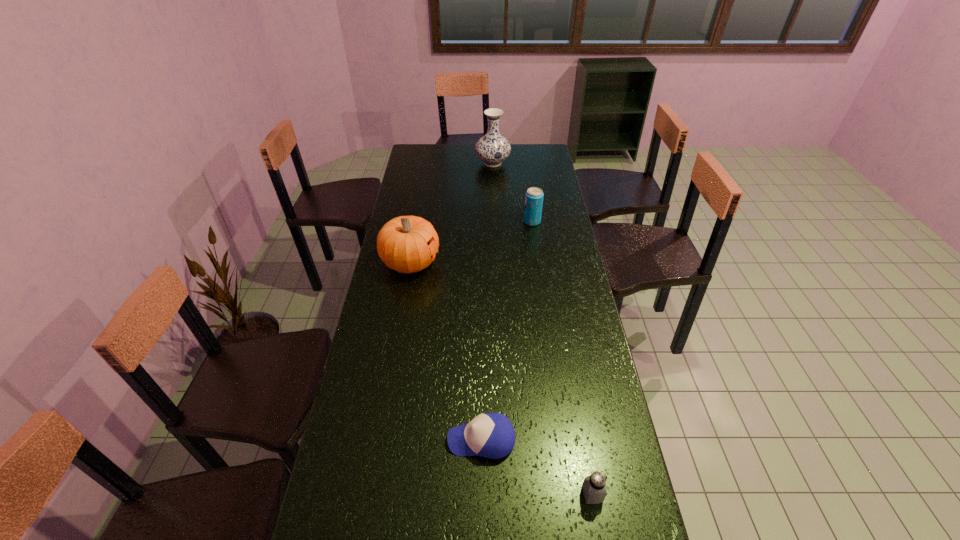
Where is `free location at the left edge`? free location at the left edge is located at coordinates (348, 531).

Locate an element on the screen. This screenshot has width=960, height=540. vacant region at the right edge of the desktop is located at coordinates (579, 311).

The height and width of the screenshot is (540, 960). Identify the location of blank area at the far right corner. (523, 152).

Where is `free space that is in between the tallest object and the third tallest object`? This screenshot has height=540, width=960. free space that is in between the tallest object and the third tallest object is located at coordinates (513, 192).

This screenshot has width=960, height=540. Find the location of `empty space between the soda can and the saltshaker`. empty space between the soda can and the saltshaker is located at coordinates (563, 358).

At what (x,y) coordinates should I click in order to perform the action: click on empty space that is in between the nearest object and the soda can. Please return your answer as a coordinate pair (x, y). The width and height of the screenshot is (960, 540). Looking at the image, I should click on (563, 358).

Locate an element on the screen. free space that is in between the second nearest object and the soda can is located at coordinates (507, 330).

You are a GUI agent. You are given a task and a screenshot of the screen. Output one action in this format:
    pyautogui.click(x=<x>, y=<y>)
    Task: Click on the free area in between the leftmost object and the tallest object
    
    Given the screenshot: What is the action you would take?
    pyautogui.click(x=451, y=213)

Where is `empty location between the baseball cap and the saltshaker`? This screenshot has width=960, height=540. empty location between the baseball cap and the saltshaker is located at coordinates (537, 467).

Where is `vacant area that lies between the leftmost object and the tallest object`? The height and width of the screenshot is (540, 960). vacant area that lies between the leftmost object and the tallest object is located at coordinates (451, 213).